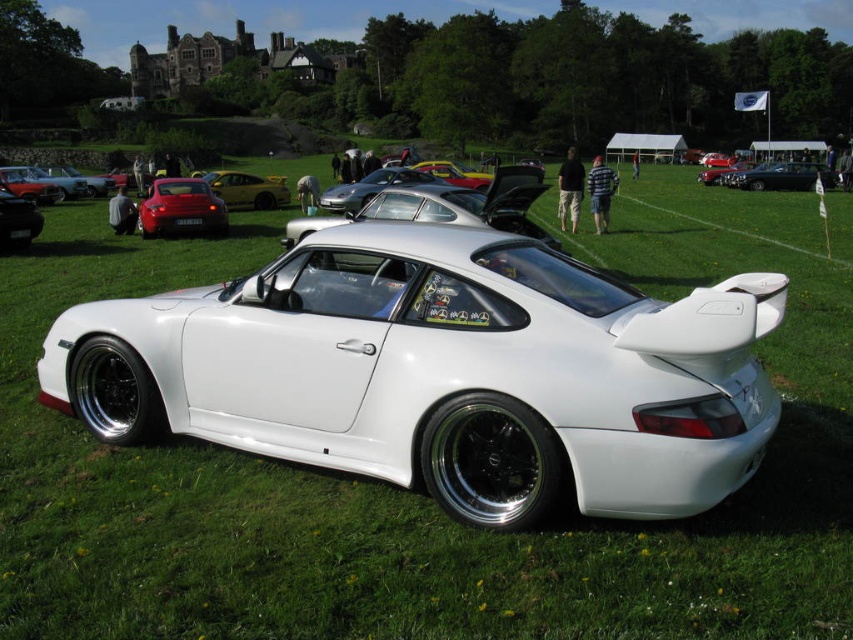
Does white glossy sports car at center have a greater width compared to shiny black car at left?

Yes, white glossy sports car at center is wider than shiny black car at left.

Does white glossy sports car at center appear on the left side of shiny black car at left?

In fact, white glossy sports car at center is to the right of shiny black car at left.

You are a GUI agent. You are given a task and a screenshot of the screen. Output one action in this format:
    pyautogui.click(x=<x>, y=<y>)
    Task: Click on the white glossy sports car at center
    The image size is (853, 640).
    Given the screenshot: What is the action you would take?
    pyautogui.click(x=442, y=372)

Is white glossy sports car at center shorter than shiny black sedan at center?

Yes, white glossy sports car at center is shorter than shiny black sedan at center.

Does white glossy sports car at center have a greater width compared to shiny black sedan at center?

Incorrect, white glossy sports car at center's width does not surpass shiny black sedan at center's.

The height and width of the screenshot is (640, 853). What are the coordinates of `white glossy sports car at center` in the screenshot? It's located at (442, 372).

Image resolution: width=853 pixels, height=640 pixels. I want to click on white glossy sports car at center, so click(442, 372).

What do you see at coordinates (247, 189) in the screenshot? I see `yellow matte sports car at center` at bounding box center [247, 189].

Does yellow matte sports car at center have a greater height compared to shiny black car at left?

Yes.

Where is `yellow matte sports car at center`? This screenshot has width=853, height=640. yellow matte sports car at center is located at coordinates (247, 189).